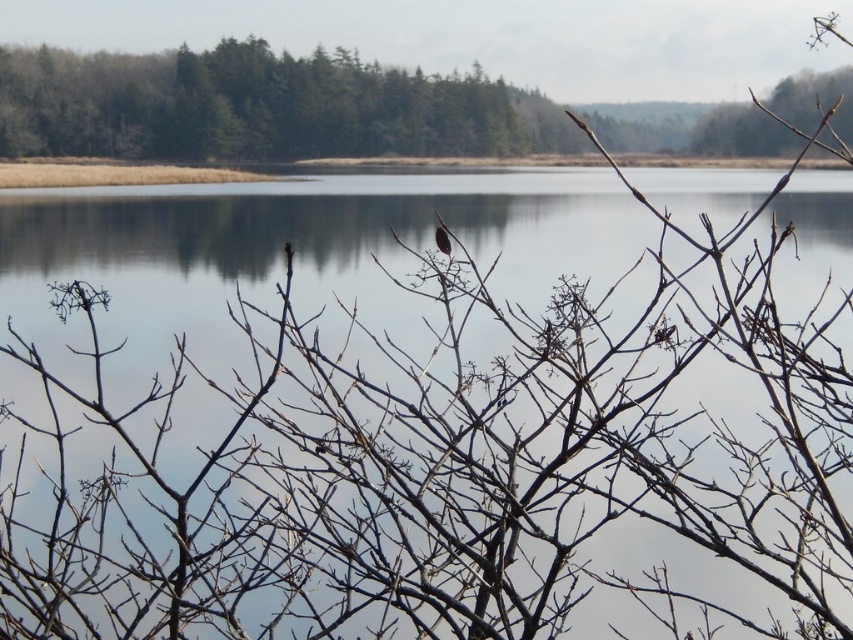
Can you confirm if transparent water at center is wider than brown matte bird at center?

Yes.

Which is above, transparent water at center or brown matte bird at center?

brown matte bird at center is higher up.

Is point (99, 545) positioned behind point (436, 232)?

That is True.

I want to click on transparent water at center, so click(x=434, y=426).